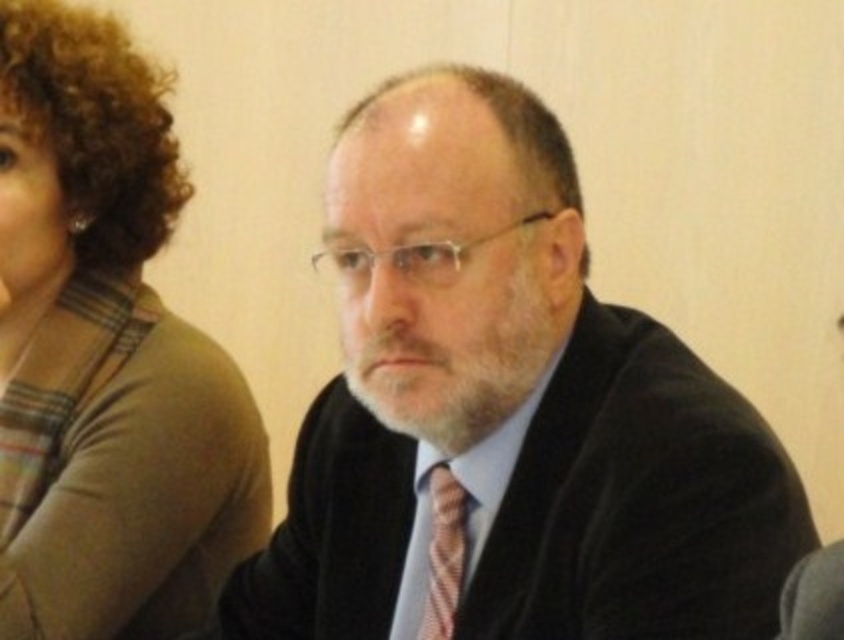
Is point (107, 513) positioned before point (430, 637)?

No, it is behind (430, 637).

Measure the distance between point (x=78, y=365) and camera.

Point (x=78, y=365) is 4.10 feet away from camera.

Image resolution: width=844 pixels, height=640 pixels. In order to click on brown plaid shirt at upper left in this screenshot , I will do `click(106, 355)`.

Is black velvet suit at center to the left of pink textured tie at center from the viewer's perspective?

In fact, black velvet suit at center is to the right of pink textured tie at center.

Describe the element at coordinates (507, 410) in the screenshot. The height and width of the screenshot is (640, 844). I see `black velvet suit at center` at that location.

At what (x,y) coordinates should I click in order to perform the action: click on black velvet suit at center. Please return your answer as a coordinate pair (x, y). The height and width of the screenshot is (640, 844). Looking at the image, I should click on (507, 410).

Is point (571, 396) more distant than point (30, 125)?

No, (571, 396) is closer to viewer.

Identify the location of black velvet suit at center. This screenshot has height=640, width=844. (507, 410).